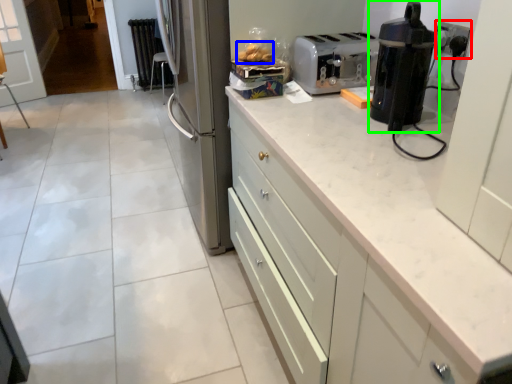
Question: Which object is the farthest from electric outlet (highlighted by a red box)? Choose among these: food (highlighted by a blue box) or home appliance (highlighted by a green box).

Choices:
 (A) food
 (B) home appliance

Answer: (A)